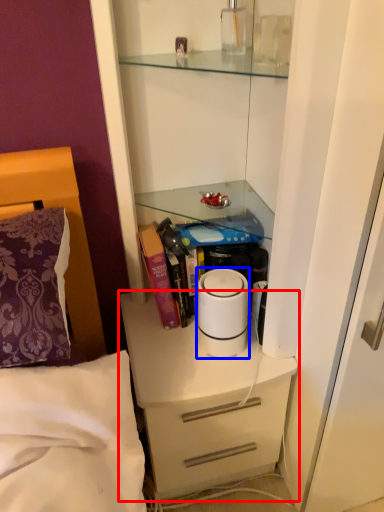
Question: Among these objects, which one is farthest to the camera, chest of drawers (highlighted by a red box) or home appliance (highlighted by a blue box)?

Choices:
 (A) chest of drawers
 (B) home appliance

Answer: (A)